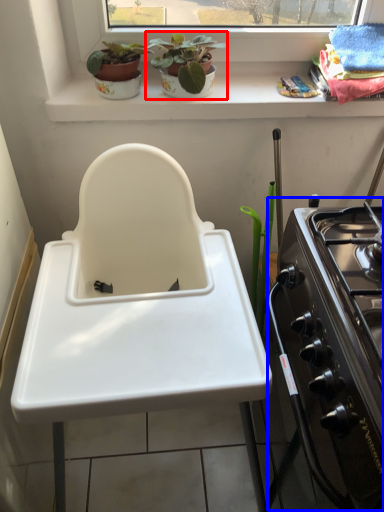
Question: Among these objects, which one is farthest to the camera, houseplant (highlighted by a red box) or oven (highlighted by a blue box)?

Choices:
 (A) houseplant
 (B) oven

Answer: (A)